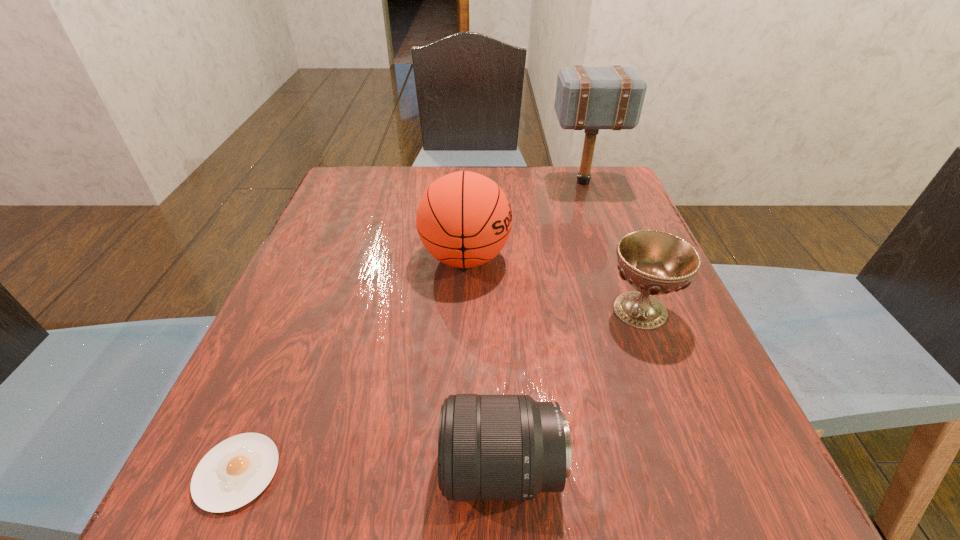
The height and width of the screenshot is (540, 960). In order to click on mallet that is at the right edge in this screenshot , I will do `click(591, 98)`.

This screenshot has width=960, height=540. I want to click on chalice that is at the right edge, so click(x=654, y=263).

Find the location of `object positioned at the near left corner`. object positioned at the near left corner is located at coordinates (233, 473).

Locate an element on the screen. object located at the far right corner is located at coordinates (591, 98).

You are a GUI agent. You are given a task and a screenshot of the screen. Output one action in this format:
    pyautogui.click(x=<x>, y=<y>)
    Task: Click on the vacant space at the far edge
    
    Given the screenshot: What is the action you would take?
    pyautogui.click(x=547, y=199)

I want to click on vacant position at the left edge of the desktop, so click(x=350, y=315).

Image resolution: width=960 pixels, height=540 pixels. In the image, there is a desktop. In order to click on vacant region at the right edge in this screenshot , I will do coord(609,300).

The image size is (960, 540). I want to click on vacant space at the far left corner, so click(377, 188).

Where is `vacant space at the near left corner of the desktop`? vacant space at the near left corner of the desktop is located at coordinates (286, 508).

Identify the location of vacant space at the far right corner of the desktop. The height and width of the screenshot is (540, 960). (612, 182).